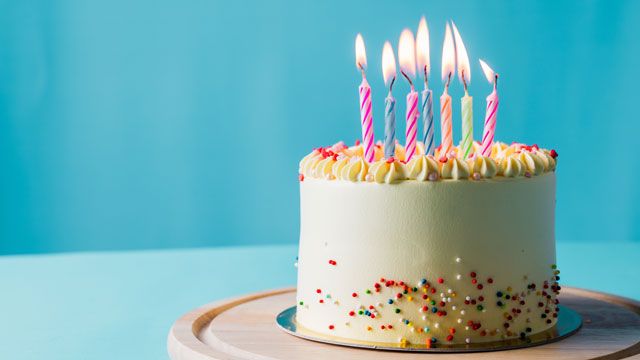
Find the location of a particular element. The height and width of the screenshot is (360, 640). candle flame is located at coordinates (360, 50), (388, 65), (404, 51), (420, 49), (445, 54), (461, 61), (488, 69).